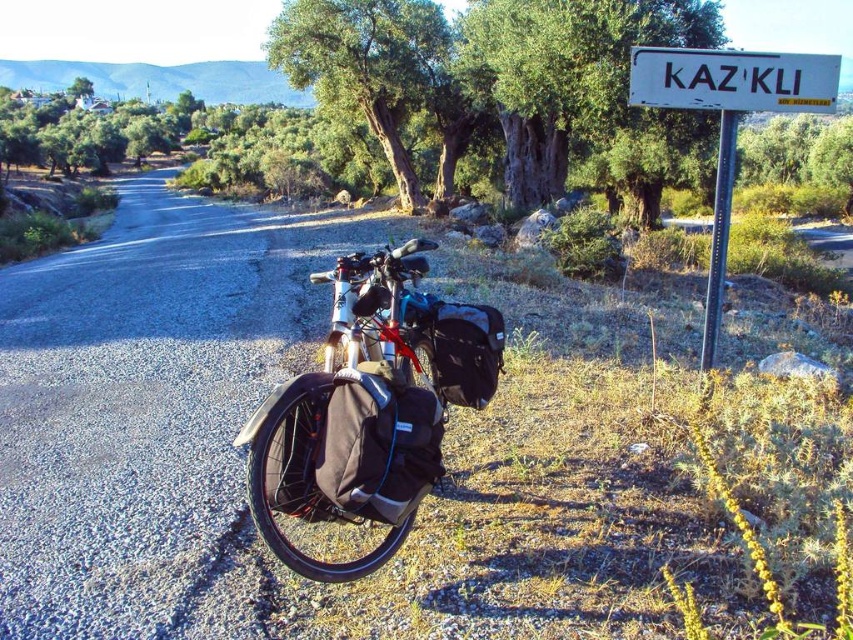
Question: Which object is farther from the camera taking this photo?

Choices:
 (A) shiny metallic bicycle at center
 (B) white plastic sign at upper center
 (C) matte black bicycle at center

Answer: (B)

Question: Which object appears closest to the camera in this image?

Choices:
 (A) green rough bark tree at center
 (B) white plastic sign at upper center

Answer: (B)

Question: Is matte black bicycle at center thinner than white plastic sign at upper right?

Choices:
 (A) yes
 (B) no

Answer: (A)

Question: Does green leafy tree at upper center have a greater width compared to white plastic sign at upper right?

Choices:
 (A) no
 (B) yes

Answer: (A)

Question: Does matte black bicycle at center come behind white plastic sign at upper right?

Choices:
 (A) yes
 (B) no

Answer: (B)

Question: Which is nearer to the white plastic sign at upper center?

Choices:
 (A) green rough bark tree at center
 (B) green leafy tree at upper center
 (C) matte black bicycle at center

Answer: (B)